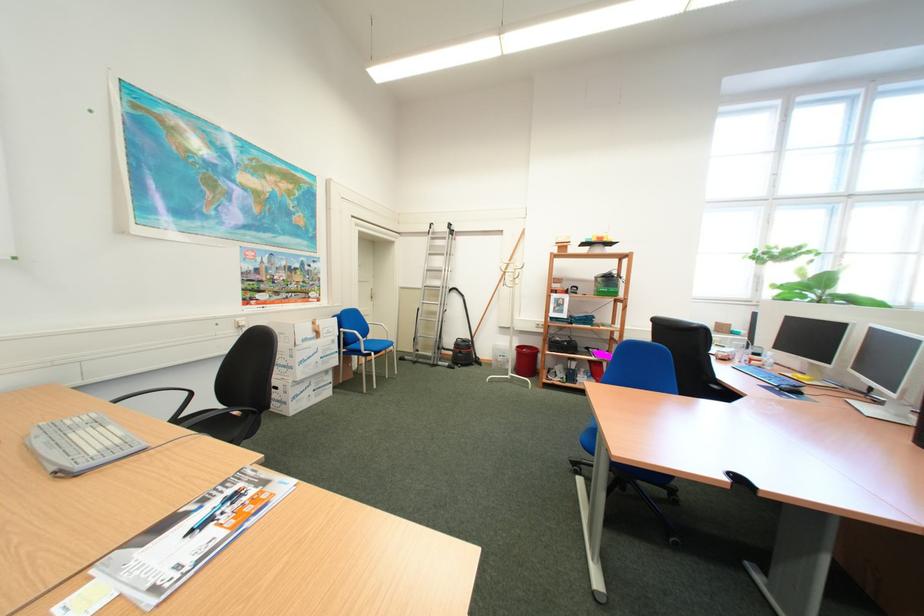
Where is `metal ladder`? The height and width of the screenshot is (616, 924). metal ladder is located at coordinates (432, 294).